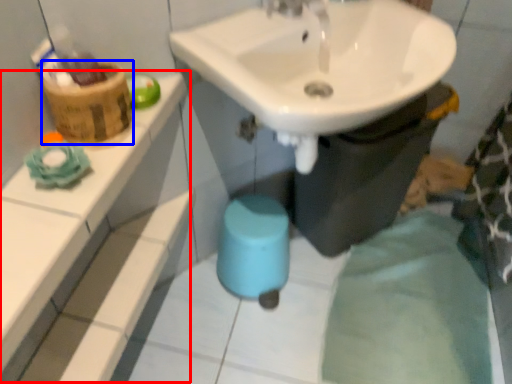
Question: Which object appears farthest to the camera in this image, balustrade (highlighted by a red box) or basket (highlighted by a blue box)?

Choices:
 (A) balustrade
 (B) basket

Answer: (B)